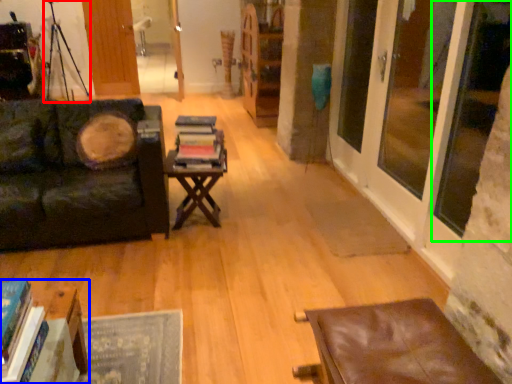
Question: Estimate the real-world distances between objects in this image. Which object is farther from tripod (highlighted by a red box), table (highlighted by a blue box) or window screen (highlighted by a green box)?

Choices:
 (A) table
 (B) window screen

Answer: (B)